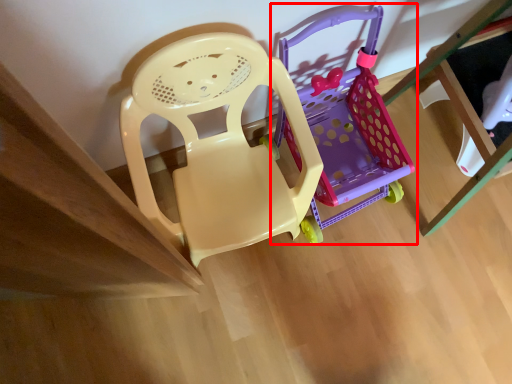
Question: Where is toy (annotated by the red box) located in relation to chair in the image?

Choices:
 (A) left
 (B) right

Answer: (B)